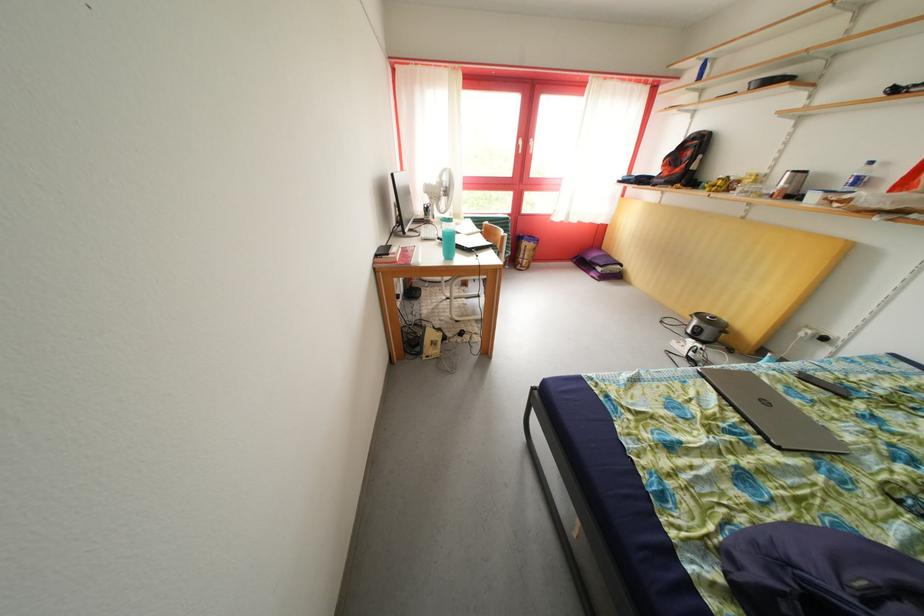
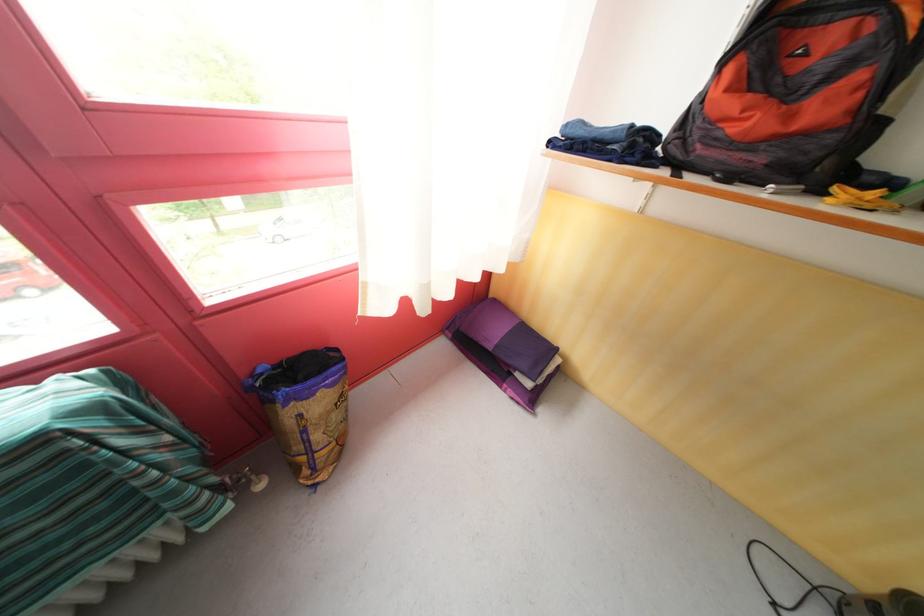
Find the pixel in the second image that matches (x=529, y=262) in the first image.

(305, 454)